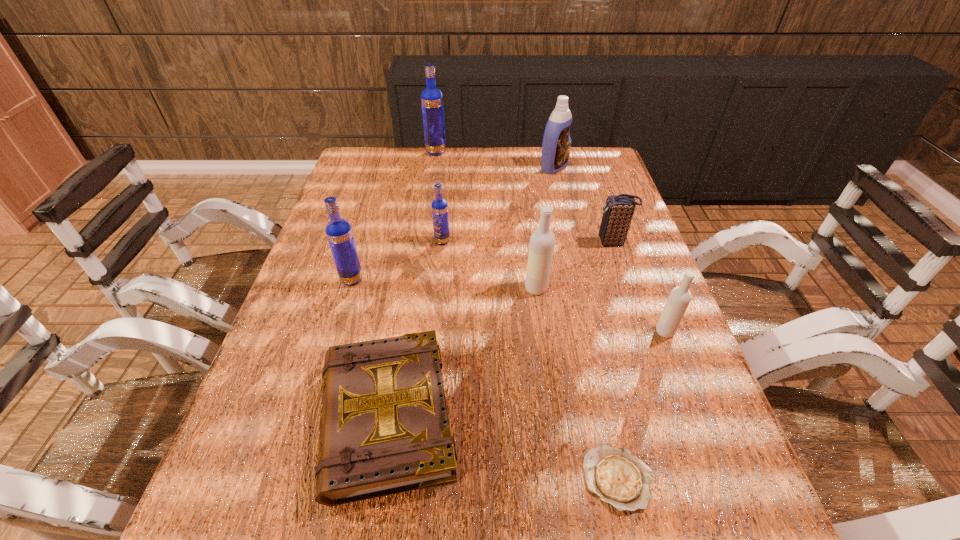
What are the coordinates of `vodka located in the left edge section of the desktop` in the screenshot? It's located at 338,231.

Where is `hardback book located in the left edge section of the desktop`? hardback book located in the left edge section of the desktop is located at coordinates (384, 428).

The image size is (960, 540). I want to click on detergent situated at the right edge, so click(556, 145).

You are a GUI agent. You are given a task and a screenshot of the screen. Output one action in this format:
    pyautogui.click(x=<x>, y=<y>)
    Task: Click on the vodka located in the right edge section of the desktop
    This screenshot has height=540, width=960.
    Given the screenshot: What is the action you would take?
    pyautogui.click(x=679, y=298)

Where is `clutch bag that is at the right edge`? The image size is (960, 540). clutch bag that is at the right edge is located at coordinates (618, 210).

The height and width of the screenshot is (540, 960). Find the location of `quiche that is at the right edge`. quiche that is at the right edge is located at coordinates (618, 477).

Where is `object present at the far right corner`? This screenshot has width=960, height=540. object present at the far right corner is located at coordinates (556, 145).

You are a GUI agent. You are given a task and a screenshot of the screen. Output one action in this format:
    pyautogui.click(x=<x>, y=<y>)
    Task: Click on the vacant space at the far edge
    Image resolution: width=960 pixels, height=540 pixels.
    Given the screenshot: What is the action you would take?
    pyautogui.click(x=506, y=158)

Find the location of a particular element. The width and height of the screenshot is (960, 540). vacant space at the left edge of the desktop is located at coordinates (384, 194).

Where is `vacant space at the right edge of the desktop`? The width and height of the screenshot is (960, 540). vacant space at the right edge of the desktop is located at coordinates (615, 255).